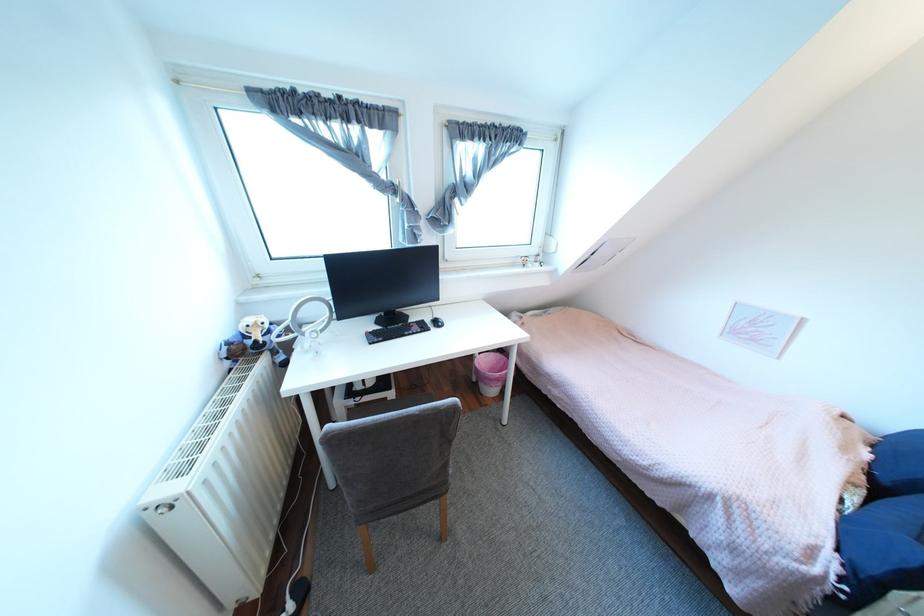
Where is `small window figurine`? This screenshot has height=616, width=924. small window figurine is located at coordinates (251, 342).